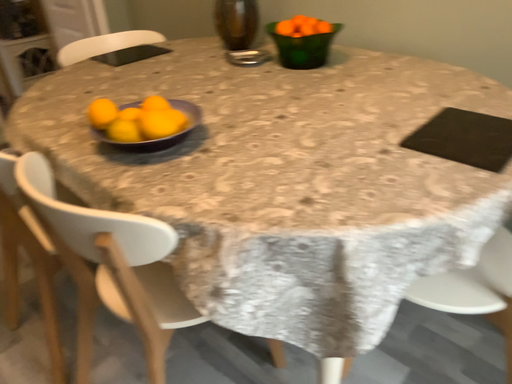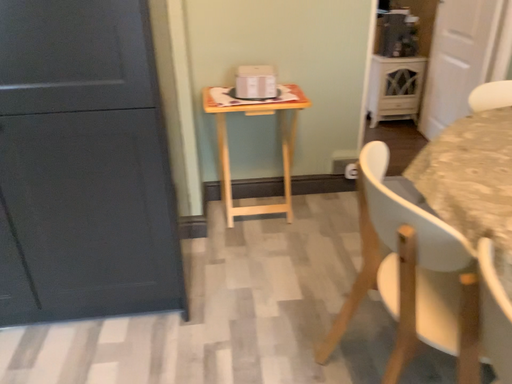
Question: How did the camera likely rotate when shooting the video?

Choices:
 (A) rotated right
 (B) rotated left

Answer: (B)